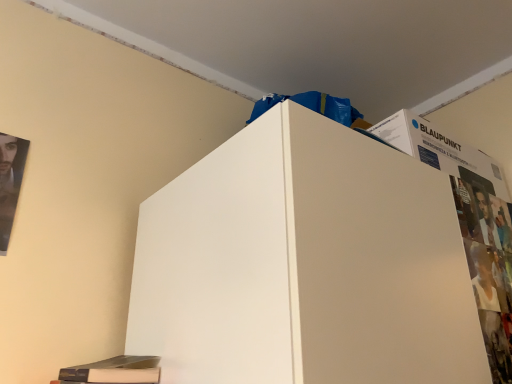
Question: Is matte black poster at left surrounded by matte black magazine at lower left?

Choices:
 (A) yes
 (B) no

Answer: (B)

Question: Does matte black magazine at lower left touch matte black poster at left?

Choices:
 (A) no
 (B) yes

Answer: (A)

Question: Can you confirm if matte black magazine at lower left is positioned to the left of matte black poster at left?

Choices:
 (A) yes
 (B) no

Answer: (B)

Question: Is matte black magazine at lower left bigger than matte black poster at left?

Choices:
 (A) yes
 (B) no

Answer: (A)

Question: From the image's perspective, would you say matte black magazine at lower left is positioned over matte black poster at left?

Choices:
 (A) no
 (B) yes

Answer: (A)

Question: Can you confirm if matte black magazine at lower left is wider than matte black poster at left?

Choices:
 (A) no
 (B) yes

Answer: (B)

Question: Considering the relative sizes of matte black poster at left and matte black magazine at lower left in the image provided, is matte black poster at left thinner than matte black magazine at lower left?

Choices:
 (A) no
 (B) yes

Answer: (B)

Question: From the image's perspective, is matte black poster at left over matte black magazine at lower left?

Choices:
 (A) no
 (B) yes

Answer: (B)

Question: Is matte black poster at left touching matte black magazine at lower left?

Choices:
 (A) yes
 (B) no

Answer: (B)

Question: Could you tell me if matte black poster at left is turned towards matte black magazine at lower left?

Choices:
 (A) yes
 (B) no

Answer: (B)

Question: Is matte black poster at left oriented away from matte black magazine at lower left?

Choices:
 (A) yes
 (B) no

Answer: (B)

Question: Does matte black poster at left come behind matte black magazine at lower left?

Choices:
 (A) no
 (B) yes

Answer: (B)

Question: Is matte black magazine at lower left in front of or behind matte black poster at left in the image?

Choices:
 (A) behind
 (B) front

Answer: (B)